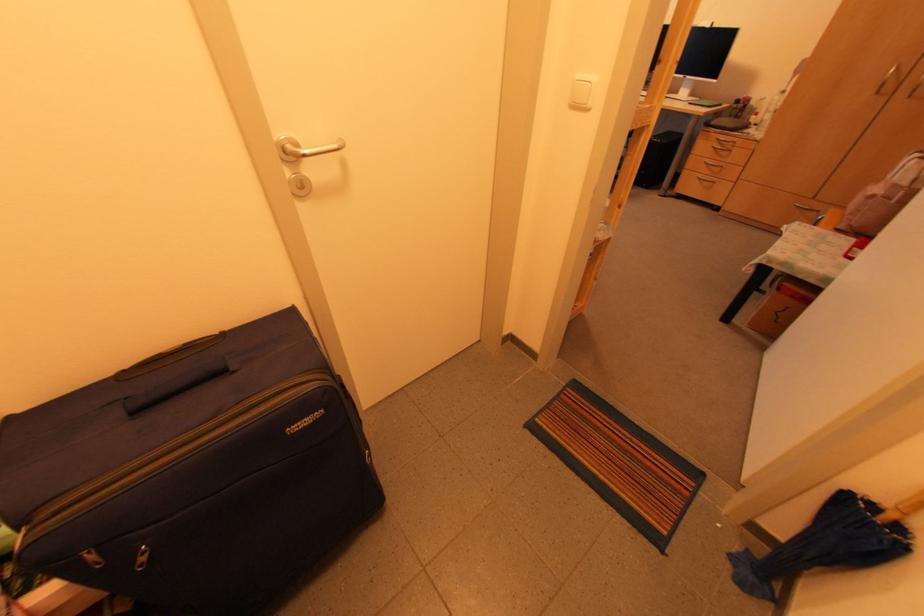
The width and height of the screenshot is (924, 616). What do you see at coordinates (302, 160) in the screenshot?
I see `the silver door handle` at bounding box center [302, 160].